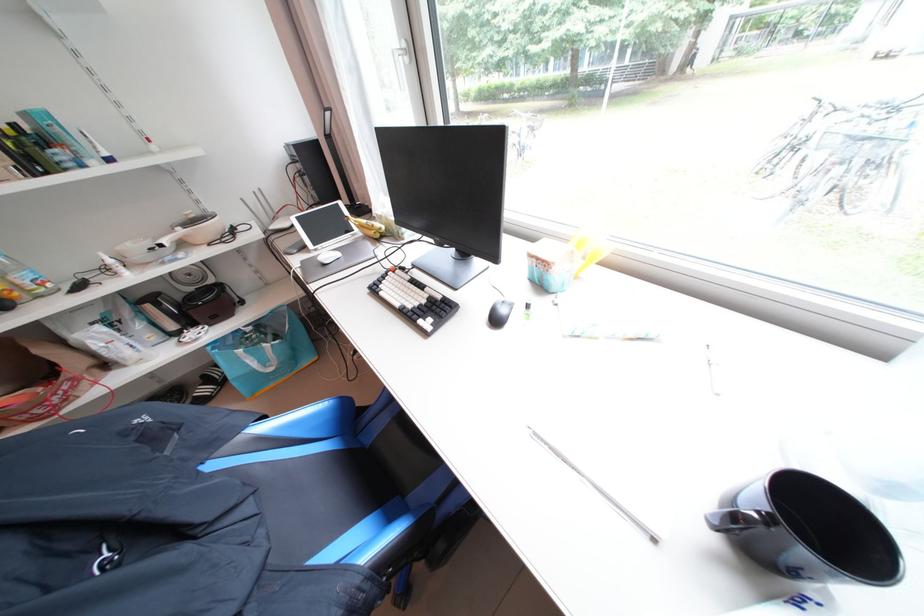
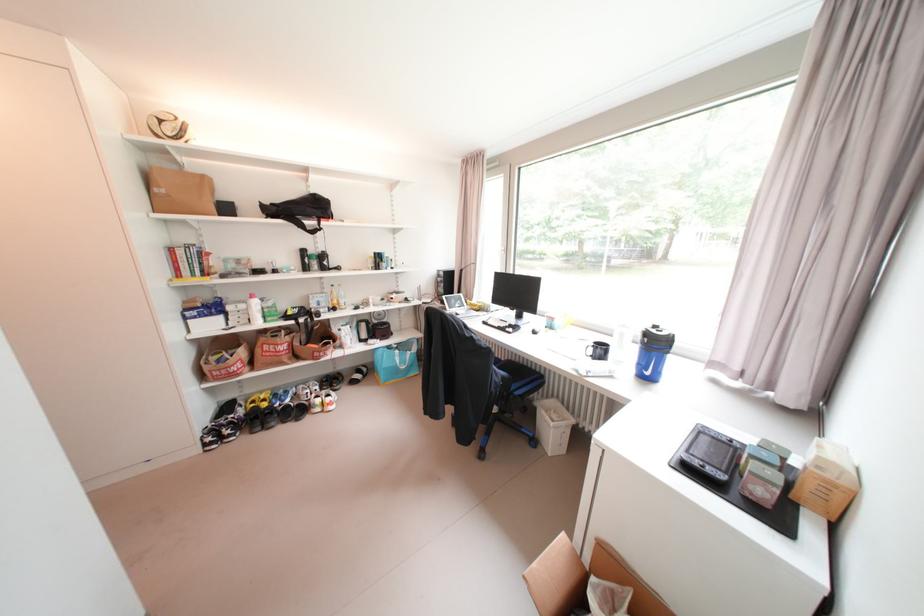
Question: Which direction would the cameraman need to move to produce the second image? Reply with the corresponding letter.

Choices:
 (A) Left
 (B) Right
 (C) Forward
 (D) Backward

Answer: (D)